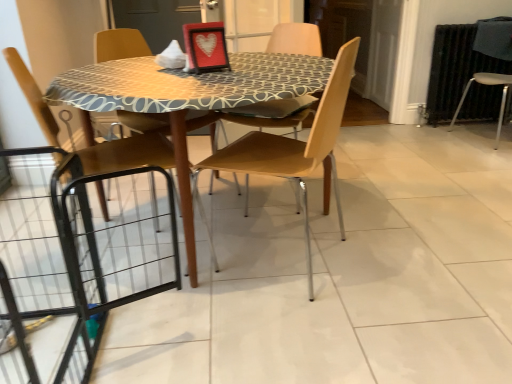
The width and height of the screenshot is (512, 384). I want to click on vacant area that lies in front of wooden chair at center, the second chair positioned from the left, so coord(282,322).